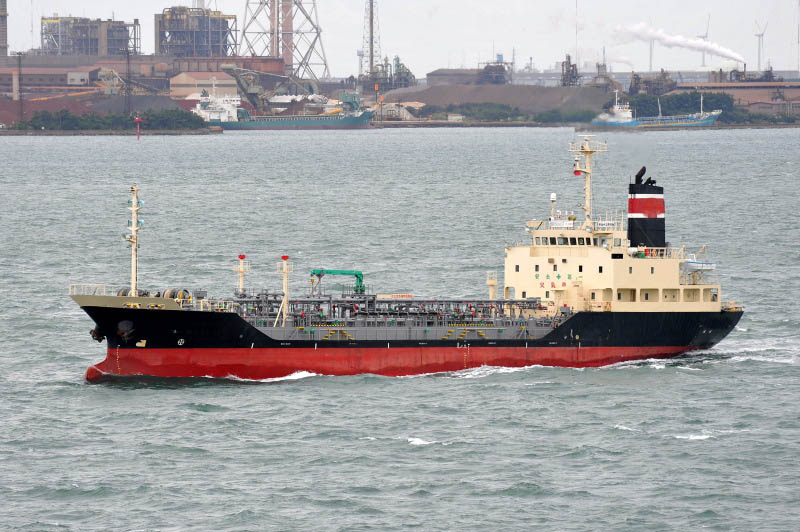
The width and height of the screenshot is (800, 532). Identify the location of windows. (630, 271), (654, 271).